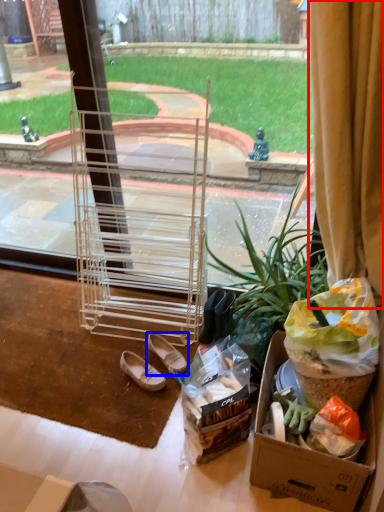
Question: Which of the following is the closest to the observer, curtain (highlighted by a red box) or footwear (highlighted by a blue box)?

Choices:
 (A) curtain
 (B) footwear

Answer: (A)